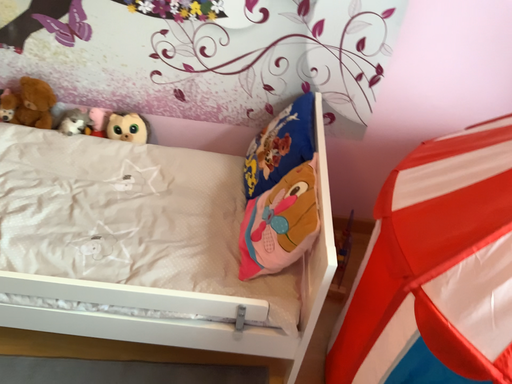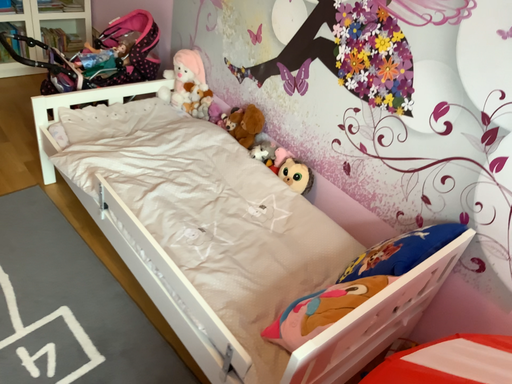
Question: Which way did the camera rotate in the video?

Choices:
 (A) rotated downward
 (B) rotated upward

Answer: (B)